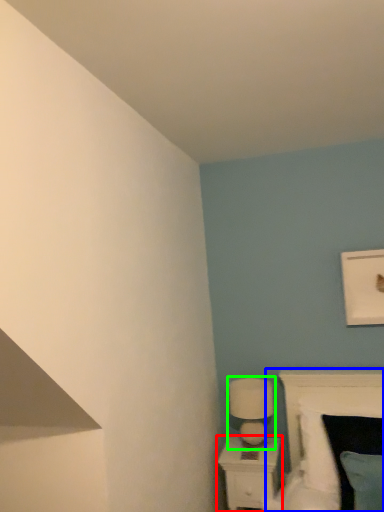
Question: Considering the real-world distances, which object is farthest from nightstand (highlighted by a red box)? bed (highlighted by a blue box) or table lamp (highlighted by a green box)?

Choices:
 (A) bed
 (B) table lamp

Answer: (A)